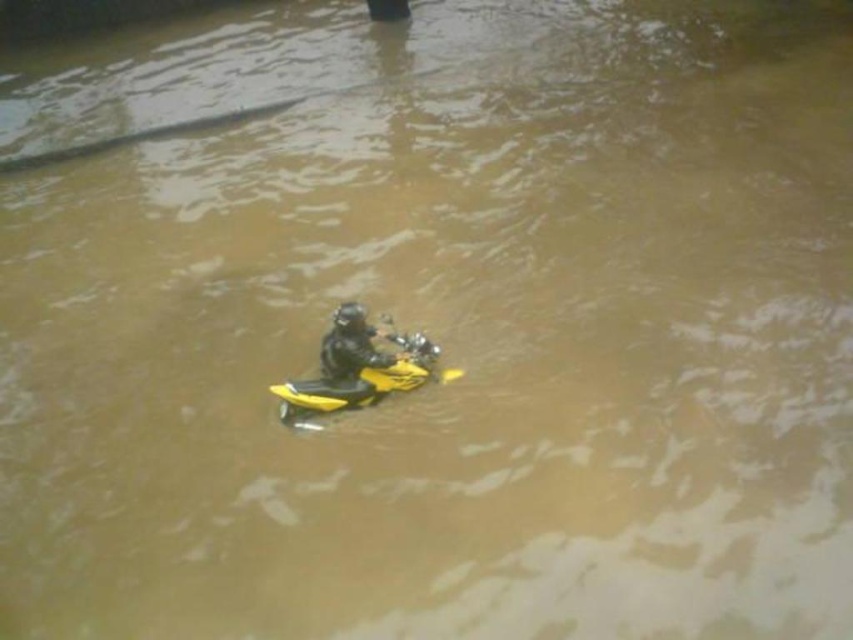
You are a delivery person who needs to deliver a package to a customer located behind the flooded area. The motorcycle you are riding has a yellow matte motorcycle at center and a black matte helmet at center. To ensure safe passage through the flooded area, which object should you adjust first to avoid water entering critical components?

The black matte helmet at center is behind the yellow matte motorcycle at center, so you should adjust the black matte helmet at center first to ensure it is properly secured and not blocking any engine parts that could be submerged in water.

You are a delivery rider who needs to deliver a package to a customer located at point (358, 374). You are currently riding a yellow matte motorcycle at center. Can you reach the customer directly without getting off the motorcycle?

The point (358, 374) is on the yellow matte motorcycle at center, so yes, you can reach the customer directly without getting off the motorcycle because the destination is already on your current position.

You are a photographer trying to capture the yellow matte motorcycle at center and the black matte helmet at center in a single shot. Given their sizes, which object will appear bigger in your photo?

The yellow matte motorcycle at center will appear bigger in the photo because it is larger in size than the black matte helmet at center.